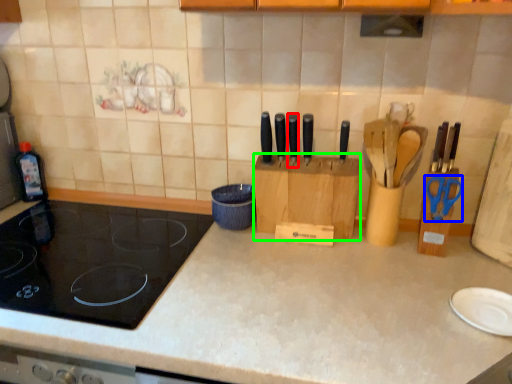
Question: Based on their relative distances, which object is farther from knife (highlighted by a red box)? Choose from scissors (highlighted by a blue box) and cardboard box (highlighted by a green box).

Choices:
 (A) scissors
 (B) cardboard box

Answer: (A)